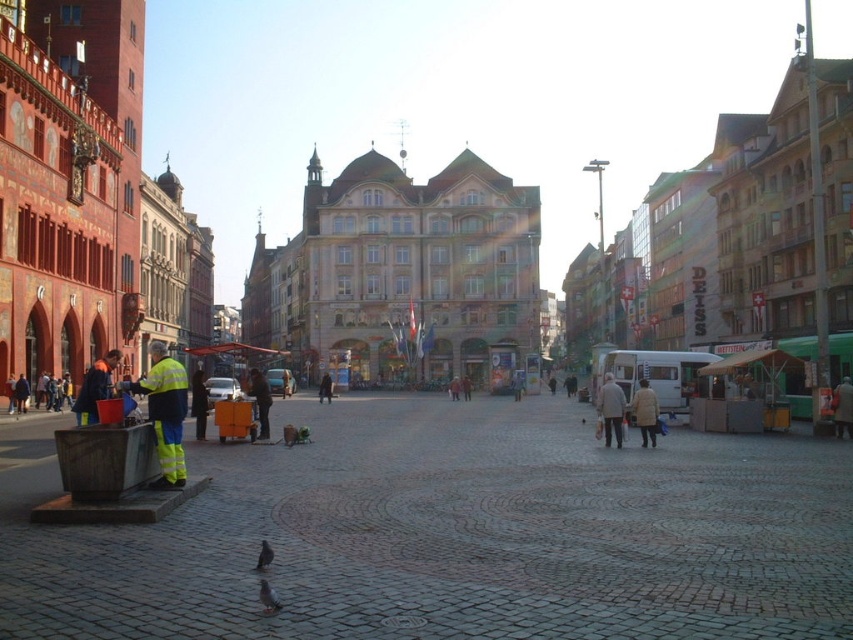
You are standing in the urban square and want to move from the point closer to you to the point further away. Which path should you take between the two points, point (181, 371) and point (276, 602)?

You should move from point (181, 371) to point (276, 602) because point (181, 371) is closer to you and point (276, 602) is further away, so the path goes from the closer to the further point.

You are a delivery person carrying a package that is 30 cm wide. You see a light beige coat at center and a gray feathered bird at center in the square. Can the package fit between them?

The light beige coat at center is wider than the gray feathered bird at center. Since the package is 30 cm wide, it depends on the actual width of the space between them. However, the description only states the coat is wider than the bird, not the distance between them. Therefore, we cannot determine if the package will fit based on the given information.

You are a tourist standing at the point marked by the coordinates point (x=611, y=410). Looking around the bustling urban square, you see a light beige coat at center. Which direction should you walk to reach the light beige coat at center from your current position?

The light beige coat at center is located at the point marked by the coordinates point (x=611, y=410), so you are already at the location of the light beige coat at center. There is no need to walk further.